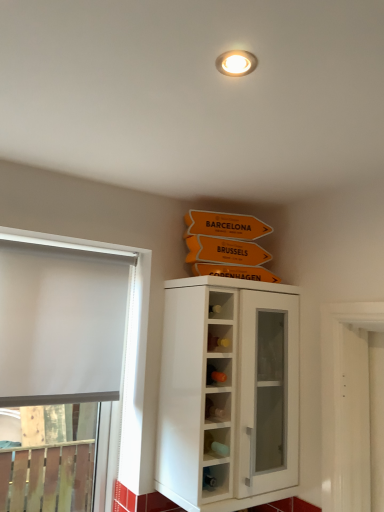
Question: Should I look upward or downward to see white glossy cupboard at center?

Choices:
 (A) up
 (B) down

Answer: (B)

Question: Can you confirm if white glossy cupboard at center is shorter than white matte window at left?

Choices:
 (A) no
 (B) yes

Answer: (B)

Question: Is white matte window at left inside white glossy cupboard at center?

Choices:
 (A) no
 (B) yes

Answer: (A)

Question: Is white glossy cupboard at center at the right side of white matte window at left?

Choices:
 (A) no
 (B) yes

Answer: (B)

Question: From a real-world perspective, is white glossy cupboard at center beneath white matte window at left?

Choices:
 (A) no
 (B) yes

Answer: (A)

Question: Is white glossy cupboard at center beside white matte window at left?

Choices:
 (A) yes
 (B) no

Answer: (B)

Question: From the image's perspective, does white glossy cupboard at center appear lower than white matte window at left?

Choices:
 (A) yes
 (B) no

Answer: (A)

Question: From the image's perspective, is white matte window at left over white glossy cupboard at center?

Choices:
 (A) yes
 (B) no

Answer: (A)

Question: Is white glossy cupboard at center surrounded by white matte window at left?

Choices:
 (A) yes
 (B) no

Answer: (B)

Question: From a real-world perspective, is white matte window at left over white glossy cupboard at center?

Choices:
 (A) no
 (B) yes

Answer: (A)

Question: From the image's perspective, does white matte window at left appear lower than white glossy cupboard at center?

Choices:
 (A) no
 (B) yes

Answer: (A)

Question: Considering the relative sizes of white matte window at left and white glossy cupboard at center in the image provided, is white matte window at left smaller than white glossy cupboard at center?

Choices:
 (A) yes
 (B) no

Answer: (A)

Question: Considering the relative sizes of white matte window at left and white glossy cupboard at center in the image provided, is white matte window at left taller than white glossy cupboard at center?

Choices:
 (A) no
 (B) yes

Answer: (B)

Question: From the image's perspective, is white glossy cupboard at center above or below white matte window at left?

Choices:
 (A) below
 (B) above

Answer: (A)